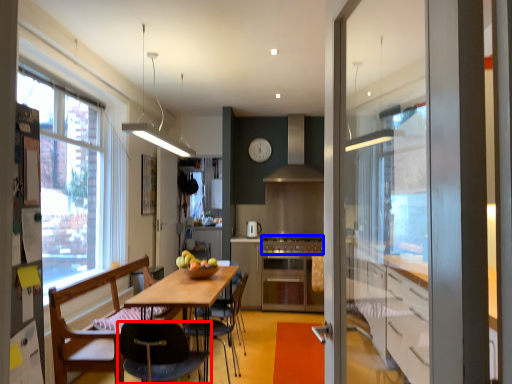
Question: Which of the following is the farthest to the observer, chair (highlighted by a red box) or stove (highlighted by a blue box)?

Choices:
 (A) chair
 (B) stove

Answer: (B)